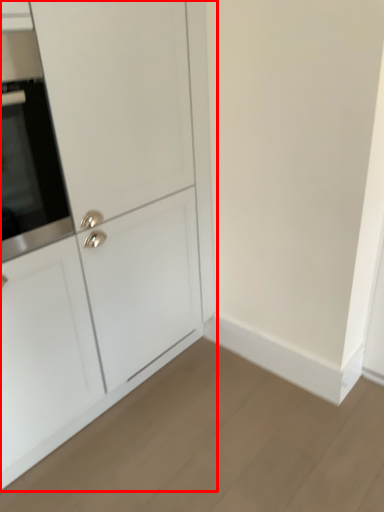
Question: In this image, where is cabinetry (annotated by the red box) located relative to oven?

Choices:
 (A) left
 (B) right

Answer: (B)